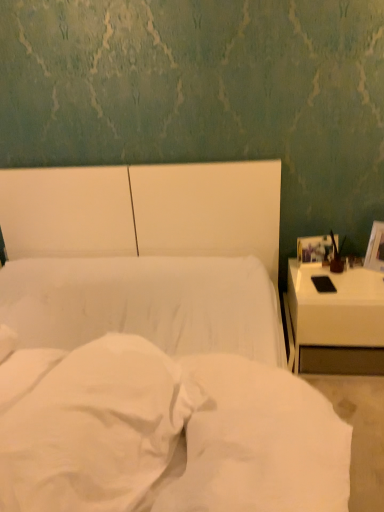
Question: Does white glossy nightstand at right contain white soft fabric at center?

Choices:
 (A) yes
 (B) no

Answer: (B)

Question: Is white soft fabric at center at the back of white glossy nightstand at right?

Choices:
 (A) yes
 (B) no

Answer: (B)

Question: From the image's perspective, is white glossy nightstand at right located above white soft fabric at center?

Choices:
 (A) no
 (B) yes

Answer: (B)

Question: From a real-world perspective, is white glossy nightstand at right on top of white soft fabric at center?

Choices:
 (A) no
 (B) yes

Answer: (A)

Question: Does white glossy nightstand at right come behind white soft fabric at center?

Choices:
 (A) yes
 (B) no

Answer: (A)

Question: Considering the positions of white glossy nightstand at right and white soft fabric at center in the image, is white glossy nightstand at right taller or shorter than white soft fabric at center?

Choices:
 (A) short
 (B) tall

Answer: (B)

Question: Considering the positions of white glossy nightstand at right and white soft fabric at center in the image, is white glossy nightstand at right bigger or smaller than white soft fabric at center?

Choices:
 (A) big
 (B) small

Answer: (A)

Question: Is white glossy nightstand at right wider or thinner than white soft fabric at center?

Choices:
 (A) wide
 (B) thin

Answer: (A)

Question: Is point (350, 342) closer or farther from the camera than point (195, 442)?

Choices:
 (A) closer
 (B) farther

Answer: (B)

Question: Considering the positions of point (218, 303) and point (215, 413), is point (218, 303) closer or farther from the camera than point (215, 413)?

Choices:
 (A) farther
 (B) closer

Answer: (A)

Question: From a real-world perspective, is white fabric bed at center positioned above or below white soft fabric at center?

Choices:
 (A) above
 (B) below

Answer: (B)

Question: From the image's perspective, relative to white soft fabric at center, is white fabric bed at center above or below?

Choices:
 (A) above
 (B) below

Answer: (A)

Question: Do you think white fabric bed at center is within white soft fabric at center, or outside of it?

Choices:
 (A) outside
 (B) inside

Answer: (A)

Question: Do you think matte brown vase at right is within white glossy nightstand at right, or outside of it?

Choices:
 (A) outside
 (B) inside

Answer: (A)

Question: From their relative heights in the image, would you say matte brown vase at right is taller or shorter than white glossy nightstand at right?

Choices:
 (A) tall
 (B) short

Answer: (B)